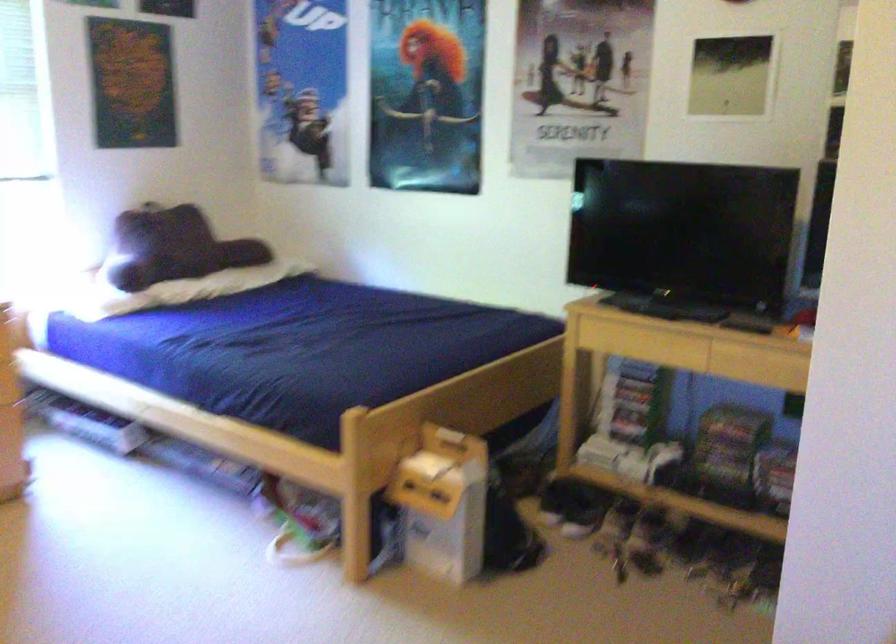
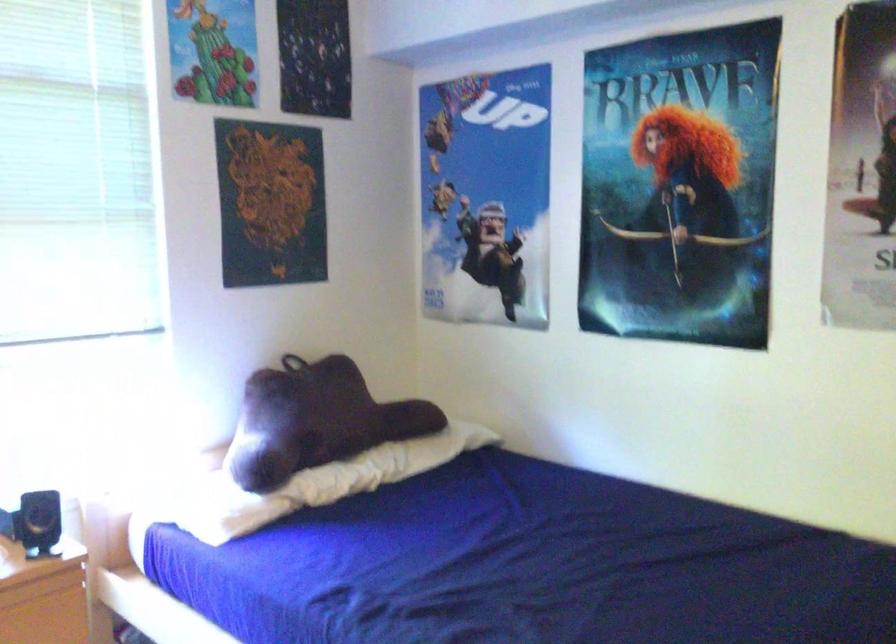
Locate, in the second image, the point that corresponds to [153,205] in the first image.

(291, 363)